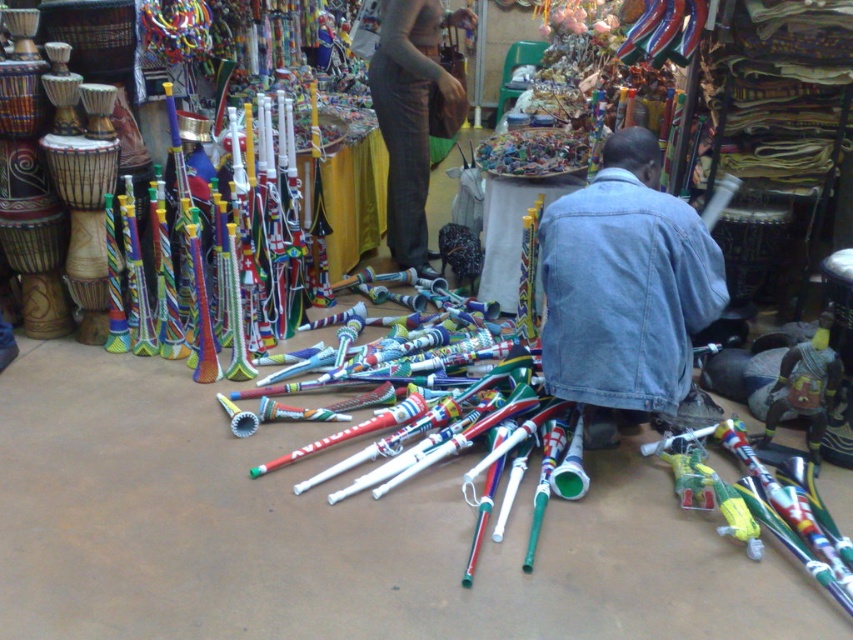
Question: Can you confirm if denim jacket at lower right is positioned below dark gray pants at center?

Choices:
 (A) yes
 (B) no

Answer: (A)

Question: Is denim jacket at lower right positioned before dark gray pants at center?

Choices:
 (A) no
 (B) yes

Answer: (B)

Question: Can you confirm if denim jacket at lower right is smaller than dark gray pants at center?

Choices:
 (A) no
 (B) yes

Answer: (B)

Question: Which object is closer to the camera taking this photo?

Choices:
 (A) denim jacket at lower right
 (B) dark gray pants at center

Answer: (A)

Question: Which of the following is the farthest from the observer?

Choices:
 (A) denim jacket at lower right
 (B) dark gray pants at center

Answer: (B)